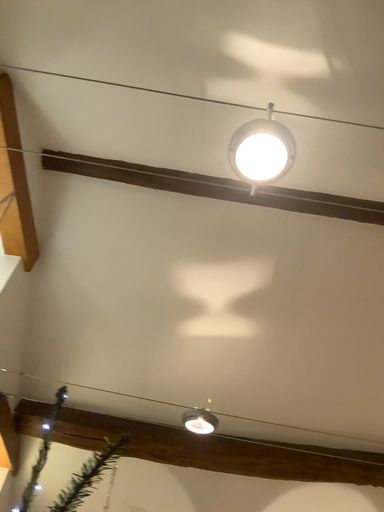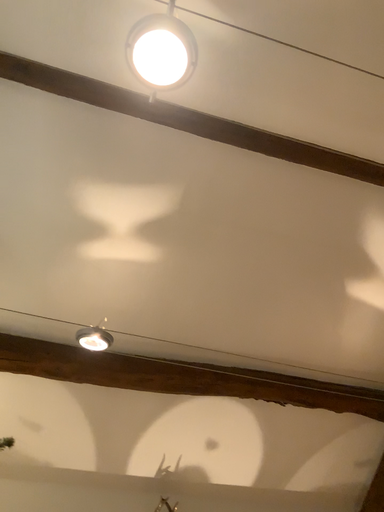
Question: How did the camera likely rotate when shooting the video?

Choices:
 (A) rotated downward
 (B) rotated upward

Answer: (A)